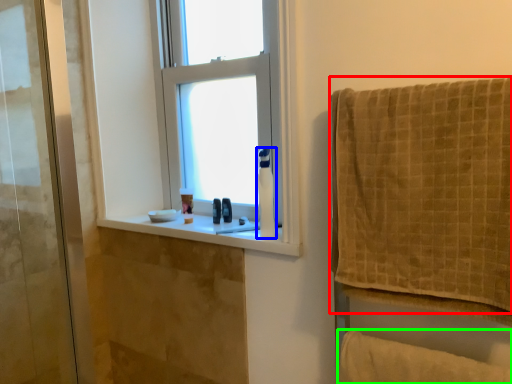
Question: Which is nearer to the towel (highlighted by a red box)? toilet paper (highlighted by a blue box) or bath towel (highlighted by a green box).

Choices:
 (A) toilet paper
 (B) bath towel

Answer: (B)